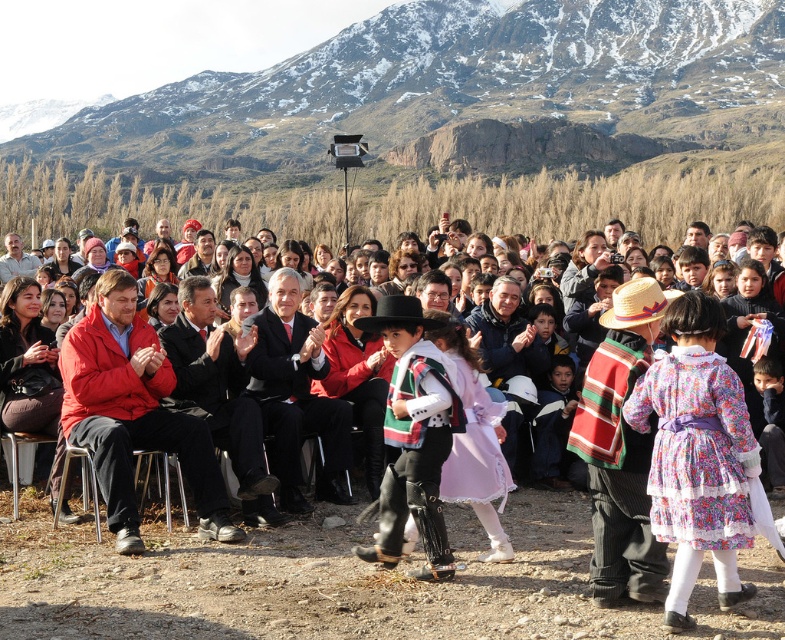
Question: Which of the following is the farthest from the observer?

Choices:
 (A) (728, 422)
 (B) (287, 166)

Answer: (B)

Question: Which of the following is the closest to the observer?

Choices:
 (A) (466, 403)
 (B) (756, 557)
 (C) (314, 124)

Answer: (B)

Question: Is snowy rock at upper center above matte black suit at center?

Choices:
 (A) no
 (B) yes

Answer: (B)

Question: Which point is farther to the camera?

Choices:
 (A) (747, 557)
 (B) (378, 518)
 (C) (689, 369)
 (D) (464, 442)

Answer: (D)

Question: Is the position of floral fabric dress at center less distant than that of knitted wool sweater at center?

Choices:
 (A) yes
 (B) no

Answer: (A)

Question: Does snowy rock at upper center have a greater width compared to floral fabric dress at center?

Choices:
 (A) no
 (B) yes

Answer: (B)